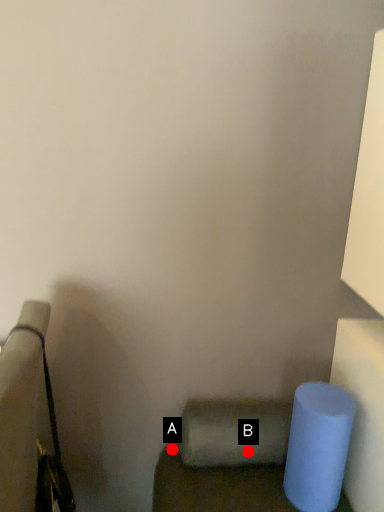
Question: Two points are circled on the image, labeled by A and B beside each circle. Among these points, which one is farthest from the camera?

Choices:
 (A) A is further
 (B) B is further

Answer: (A)